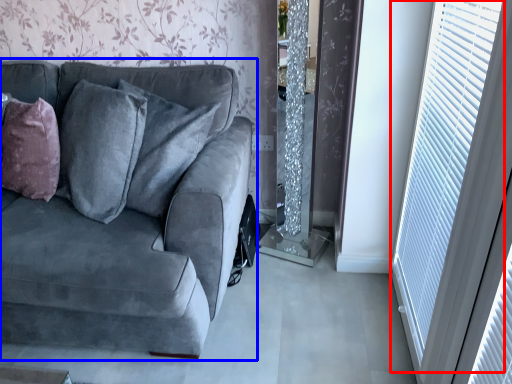
Question: Which object is closer to the camera taking this photo, window (highlighted by a red box) or studio couch (highlighted by a blue box)?

Choices:
 (A) window
 (B) studio couch

Answer: (B)